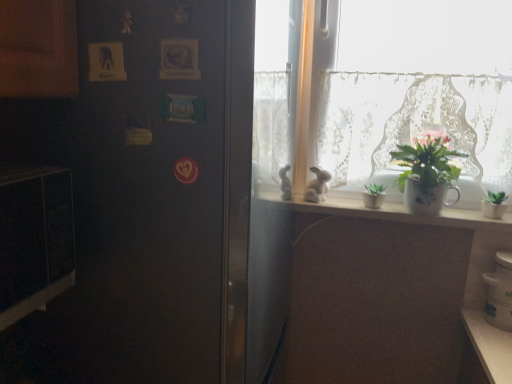
Where is `vacant space to the right of white matte rabbit at window`? The width and height of the screenshot is (512, 384). vacant space to the right of white matte rabbit at window is located at coordinates (359, 206).